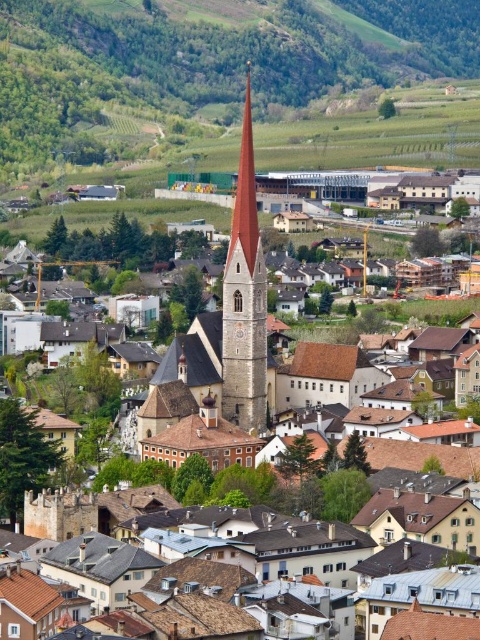
Which is behind, point (197, 449) or point (247, 132)?

The point (247, 132) is more distant.

You are a GUI agent. You are given a task and a screenshot of the screen. Output one action in this format:
    pyautogui.click(x=<x>, y=<y>)
    Task: Click on the smooth stone church steeple at center
    The image size is (480, 640).
    Given the screenshot: What is the action you would take?
    pyautogui.click(x=222, y=358)

Who is more distant from viewer, (137, 416) or (249, 148)?

The point (249, 148) is more distant.

Find the location of `smooth stone church steeple at center`. smooth stone church steeple at center is located at coordinates (222, 358).

Does green grassy hillside at upper center appear on the left side of smooth stone spire at center?

No, green grassy hillside at upper center is not to the left of smooth stone spire at center.

Between point (207, 49) and point (243, 260), which one is positioned in front?

Point (243, 260) is in front.

Locate an element on the screen. green grassy hillside at upper center is located at coordinates (205, 68).

Between green grassy hillside at upper center and smooth stone church steeple at center, which one has less height?

Standing shorter between the two is smooth stone church steeple at center.

Is point (70, 72) positioned after point (250, 316)?

That is True.

Is point (9, 128) more distant than point (264, 289)?

That is True.

Locate an element on the screen. green grassy hillside at upper center is located at coordinates (205, 68).